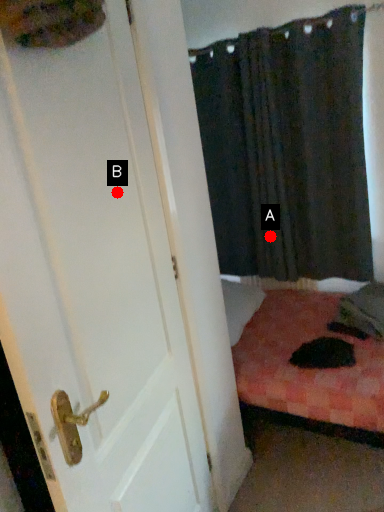
Question: Two points are circled on the image, labeled by A and B beside each circle. Which of the following is the farthest from the observer?

Choices:
 (A) A is further
 (B) B is further

Answer: (A)